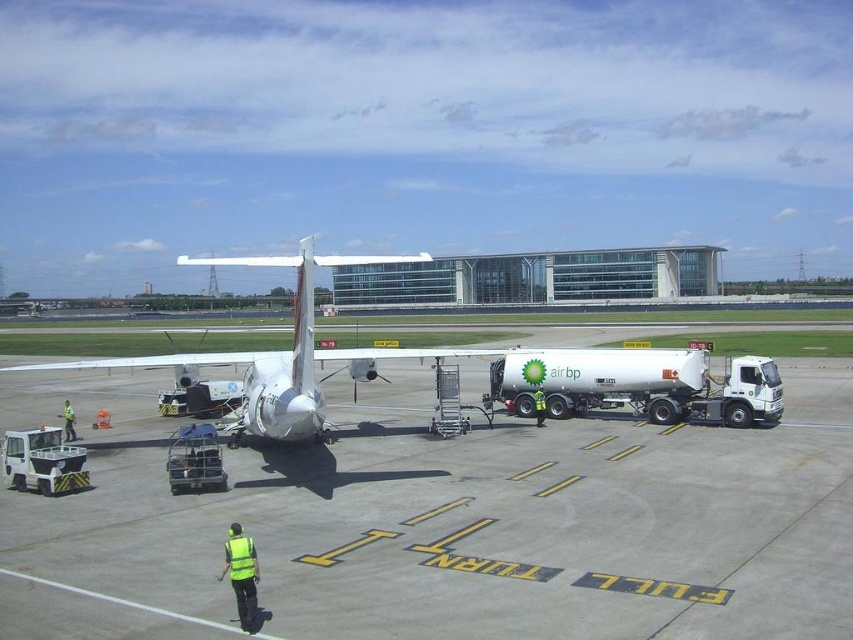
You are a maintenance worker on the tarmac. You need to inspect both the white matte airplane at center and the reflective yellow vest at lower center. Which object is bigger in size?

The white matte airplane at center is larger in size compared to the reflective yellow vest at lower center, so the airplane is bigger.

You are a pilot preparing to board your aircraft. You notice a reflective yellow vest at lower center and a white matte airplane at center. Which object is closer to you as you stand at the boarding point?

The white matte airplane at center is closer to you because the reflective yellow vest at lower center is positioned behind it.